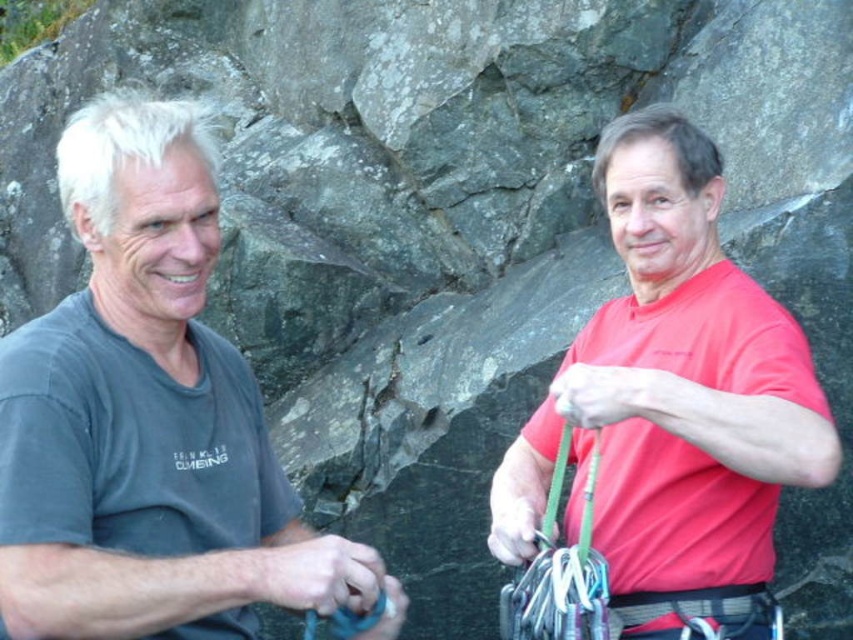
Question: Considering the relative positions of dark gray t-shirt at left and red matte shirt at right in the image provided, where is dark gray t-shirt at left located with respect to red matte shirt at right?

Choices:
 (A) left
 (B) right

Answer: (A)

Question: Which of the following is the closest to the observer?

Choices:
 (A) (154, 113)
 (B) (779, 484)

Answer: (B)

Question: Which object appears farthest from the camera in this image?

Choices:
 (A) dark gray t-shirt at left
 (B) red matte shirt at right

Answer: (B)

Question: Is dark gray t-shirt at left positioned in front of red matte shirt at right?

Choices:
 (A) no
 (B) yes

Answer: (B)

Question: Considering the relative positions of dark gray t-shirt at left and red matte shirt at right in the image provided, where is dark gray t-shirt at left located with respect to red matte shirt at right?

Choices:
 (A) right
 (B) left

Answer: (B)

Question: Which of the following is the farthest from the observer?

Choices:
 (A) red matte shirt at right
 (B) dark gray t-shirt at left

Answer: (A)